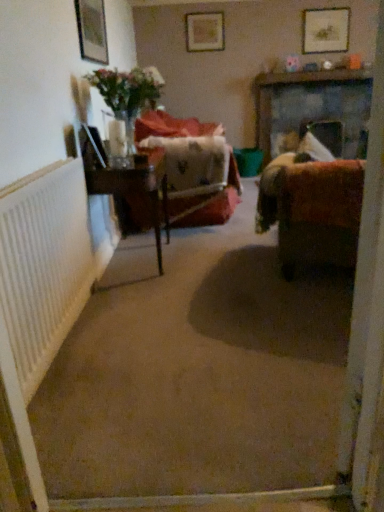
Question: In terms of width, does matte wooden picture frame at upper left, arranged as the 1th picture frame when ordered from the bottom, look wider or thinner when compared to white textured radiator at left?

Choices:
 (A) thin
 (B) wide

Answer: (A)

Question: Considering the relative positions of matte wooden picture frame at upper left, which ranks as the 3th picture frame in top-to-bottom order, and white textured radiator at left in the image provided, is matte wooden picture frame at upper left, which ranks as the 3th picture frame in top-to-bottom order, to the left or to the right of white textured radiator at left?

Choices:
 (A) left
 (B) right

Answer: (A)

Question: Based on their relative distances, which object is nearer to the velvet brown couch at right?

Choices:
 (A) wooden picture frame at upper center, which is the 1th picture frame in back-to-front order
 (B) matte wooden picture frame at upper left, which is counted as the 1th picture frame, starting from the front
 (C) velvet-like red chair at center
 (D) white textured radiator at left
 (E) wooden table at center

Answer: (E)

Question: Estimate the real-world distances between objects in this image. Which object is farther from the translucent glass vase at upper left?

Choices:
 (A) white textured radiator at left
 (B) wooden picture frame at upper center, which is the 1th picture frame in back-to-front order
 (C) velvet brown couch at right
 (D) wooden table at center
 (E) translucent glass vase at left

Answer: (B)